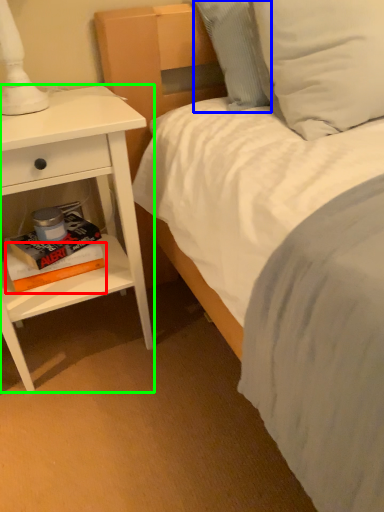
Question: Based on their relative distances, which object is farther from paperback book (highlighted by a red box)? Choose from pillow (highlighted by a blue box) and nightstand (highlighted by a green box).

Choices:
 (A) pillow
 (B) nightstand

Answer: (A)